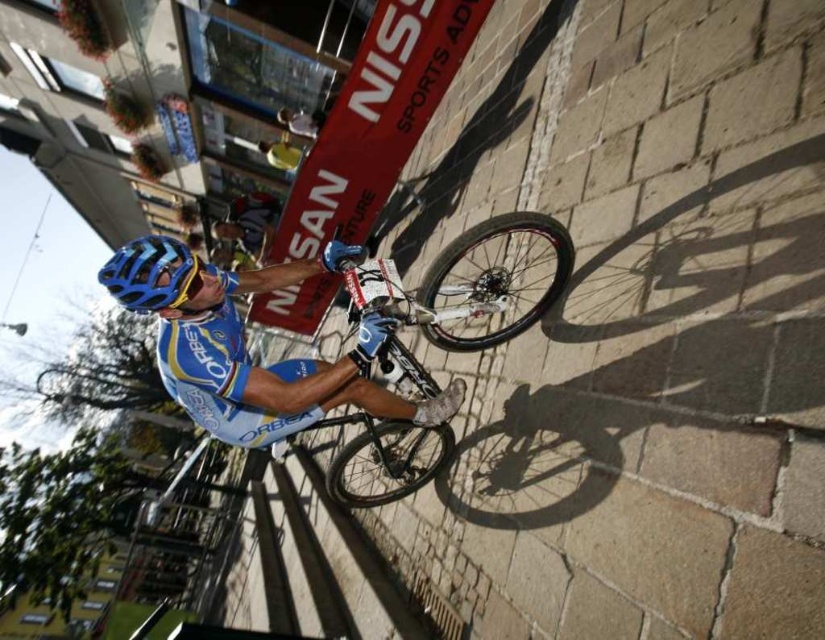
Who is taller, shiny metallic bicycle at center or blue matte bicycle helmet at center?

shiny metallic bicycle at center is taller.

Does shiny metallic bicycle at center have a greater height compared to blue matte bicycle helmet at center?

Correct, shiny metallic bicycle at center is much taller as blue matte bicycle helmet at center.

Which is behind, point (448, 259) or point (116, 282)?

Point (448, 259)

The image size is (825, 640). I want to click on shiny metallic bicycle at center, so click(465, 284).